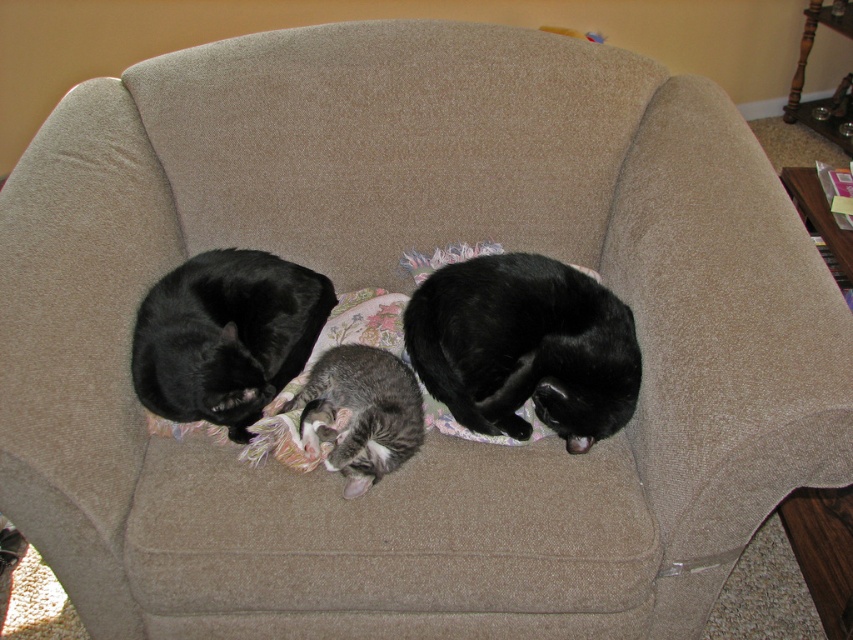
Measure the distance between point (555, 349) and camera.

They are 4.33 feet apart.

Which is above, black fur cat at center or gray tabby cat at center?

black fur cat at center

Between point (471, 346) and point (381, 449), which one is positioned in front?

Point (381, 449)

Locate an element on the screen. The height and width of the screenshot is (640, 853). black fur cat at center is located at coordinates (524, 348).

Based on the photo, is black fur cat at left to the left of gray tabby cat at center from the viewer's perspective?

Correct, you'll find black fur cat at left to the left of gray tabby cat at center.

Which is in front, point (158, 284) or point (379, 353)?

Point (379, 353)

Which is behind, point (325, 305) or point (346, 387)?

Positioned behind is point (325, 305).

Find the location of a particular element. The width and height of the screenshot is (853, 640). black fur cat at left is located at coordinates (225, 336).

Can you confirm if black fur cat at center is positioned to the right of black fur cat at left?

Indeed, black fur cat at center is positioned on the right side of black fur cat at left.

Between black fur cat at center and black fur cat at left, which one is positioned higher?

black fur cat at left is above.

Which is behind, point (572, 390) or point (271, 360)?

Point (271, 360)

Find the location of a particular element. black fur cat at center is located at coordinates (524, 348).